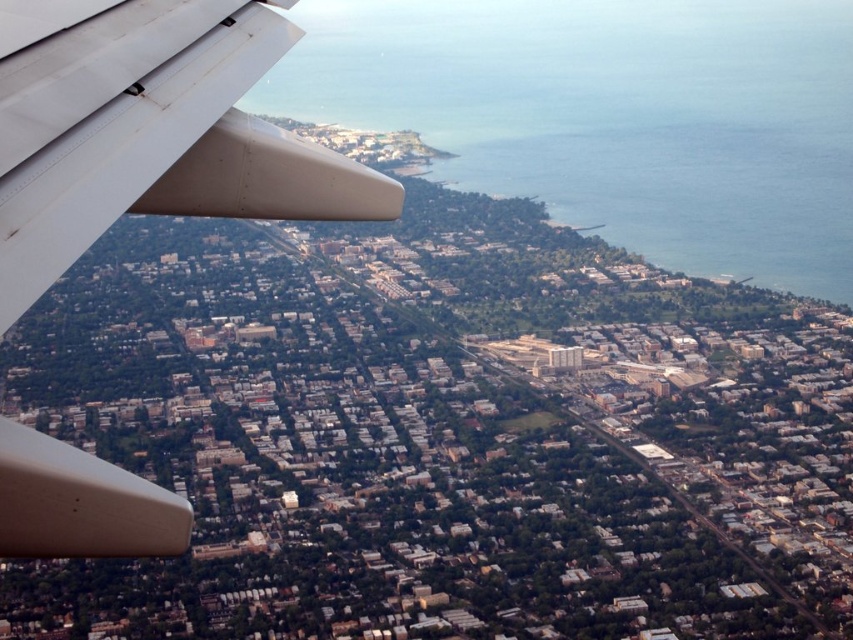
Question: Can you confirm if blue water at lower right is positioned below white matte airplane wing at upper left?

Choices:
 (A) yes
 (B) no

Answer: (B)

Question: Does blue water at lower right appear under white matte airplane wing at upper left?

Choices:
 (A) no
 (B) yes

Answer: (A)

Question: Which point is closer to the camera?

Choices:
 (A) white matte airplane wing at upper left
 (B) blue water at lower right

Answer: (A)

Question: Is the position of blue water at lower right less distant than that of white matte airplane wing at upper left?

Choices:
 (A) no
 (B) yes

Answer: (A)